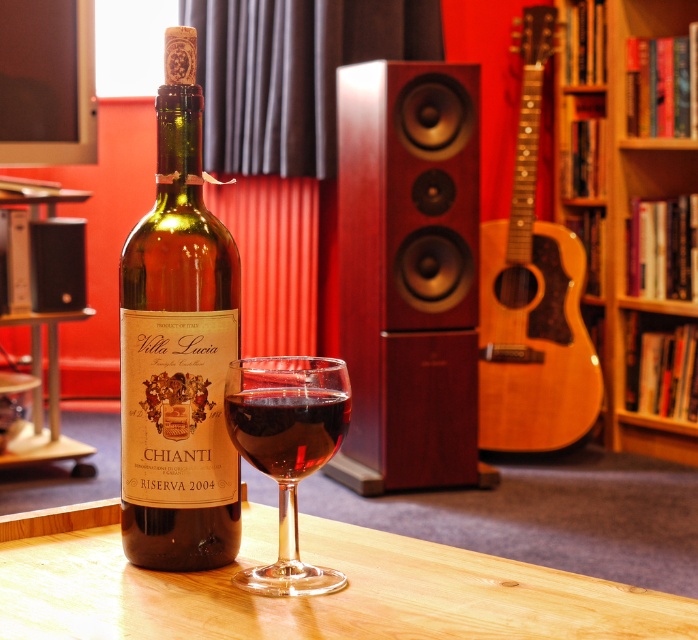
You are organizing books in a cozy indoor setting and need to place a large book. Which wooden bookshelf, the wooden bookshelf at center or the wooden bookshelf at upper right, would you choose if you want to place the book on the wider shelf?

The wooden bookshelf at center might be wider than wooden bookshelf at upper right, so you should choose the wooden bookshelf at center to place the large book.

You are setting up a dinner table and have both the transparent glass wine glass at center and the translucent glass at center. Which glass should you choose if you want to serve a full pour of wine without spilling?

You should choose the transparent glass wine glass at center because it is larger in size than the translucent glass at center, providing more capacity for the wine.